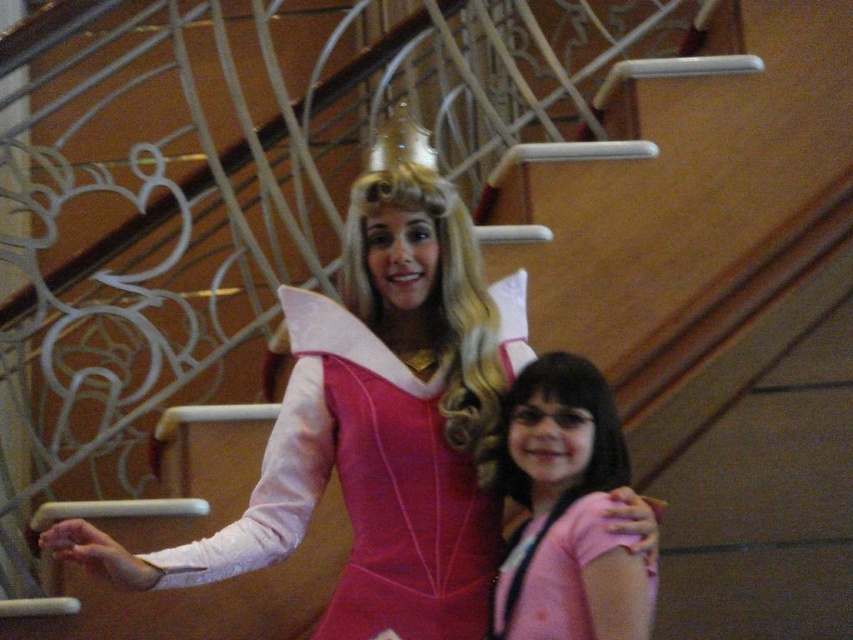
Does satin pink dress at center have a larger size compared to pink fabric at center?

Yes, satin pink dress at center is bigger than pink fabric at center.

Between satin pink dress at center and pink fabric at center, which one appears on the left side from the viewer's perspective?

satin pink dress at center is more to the left.

Between point (460, 465) and point (639, 602), which one is positioned in front?

Positioned in front is point (639, 602).

The width and height of the screenshot is (853, 640). What are the coordinates of `satin pink dress at center` in the screenshot? It's located at (363, 490).